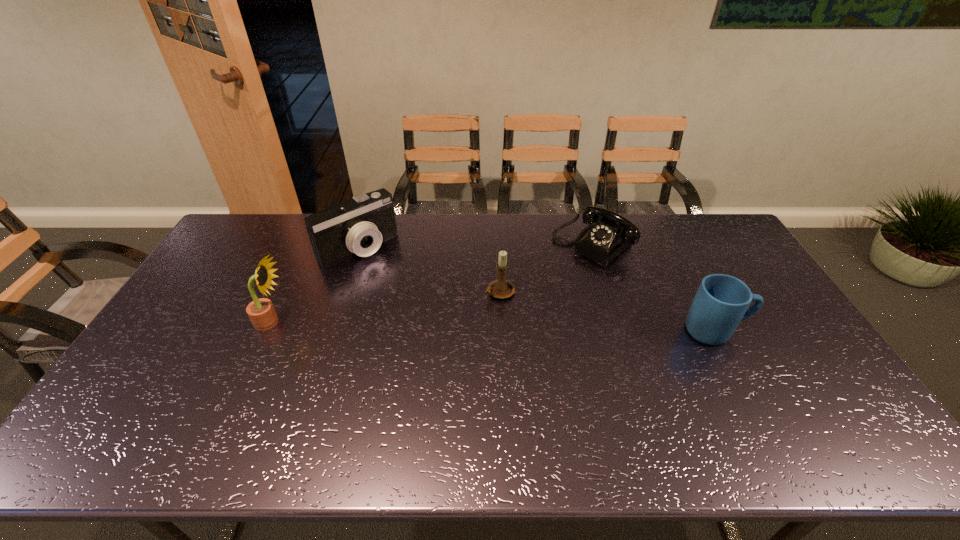
Identify the location of vacant region located on the dial of the second object from right to left. This screenshot has height=540, width=960. (500, 320).

I want to click on vacant space located 0.080m on the dial of the second object from right to left, so click(x=556, y=273).

At what (x,y) coordinates should I click in order to perform the action: click on free space located 0.060m on the dial of the second object from right to left. Please return your answer as a coordinate pair (x, y). Looking at the image, I should click on (560, 270).

Where is `blank space located 0.320m on the side of the third object from left to right with the handle`? This screenshot has height=540, width=960. blank space located 0.320m on the side of the third object from left to right with the handle is located at coordinates (397, 344).

This screenshot has width=960, height=540. Find the location of `free location located on the side of the third object from left to right with the handle`. free location located on the side of the third object from left to right with the handle is located at coordinates (467, 309).

At what (x,y) coordinates should I click in order to perform the action: click on vacant space located 0.330m on the side of the third object from left to right with the handle. Please return your answer as a coordinate pair (x, y). Looking at the image, I should click on pyautogui.click(x=394, y=346).

I want to click on vacant space positioned on the lens of the camcorder, so click(444, 329).

Identify the location of vacant space located on the lens of the camcorder. Image resolution: width=960 pixels, height=540 pixels. coord(433,318).

Where is `vacant region located 0.170m on the lens of the camcorder`? The height and width of the screenshot is (540, 960). vacant region located 0.170m on the lens of the camcorder is located at coordinates (404, 289).

Find the location of a particular element. telephone that is at the far edge is located at coordinates (612, 233).